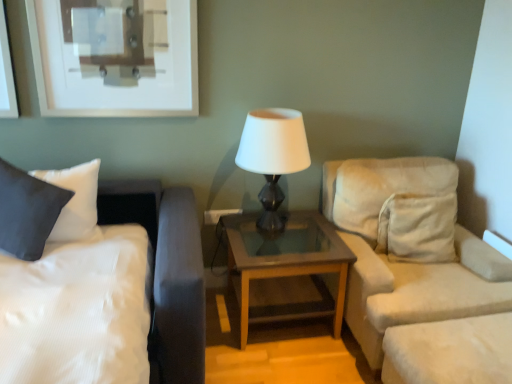
Question: Is satin white bed at left far away from beige fabric studio couch at right?

Choices:
 (A) yes
 (B) no

Answer: (A)

Question: From the image's perspective, is satin white bed at left over beige fabric studio couch at right?

Choices:
 (A) yes
 (B) no

Answer: (B)

Question: Is satin white bed at left beside beige fabric studio couch at right?

Choices:
 (A) yes
 (B) no

Answer: (B)

Question: Is satin white bed at left further to the viewer compared to beige fabric studio couch at right?

Choices:
 (A) no
 (B) yes

Answer: (A)

Question: Considering the relative sizes of satin white bed at left and beige fabric studio couch at right in the image provided, is satin white bed at left bigger than beige fabric studio couch at right?

Choices:
 (A) no
 (B) yes

Answer: (B)

Question: Is satin white bed at left facing towards beige fabric studio couch at right?

Choices:
 (A) no
 (B) yes

Answer: (A)

Question: Can you confirm if brown wood/glass table at center is smaller than matte black pillow at left?

Choices:
 (A) no
 (B) yes

Answer: (A)

Question: Is brown wood/glass table at center touching matte black pillow at left?

Choices:
 (A) yes
 (B) no

Answer: (B)

Question: Could matte black pillow at left be considered to be inside brown wood/glass table at center?

Choices:
 (A) yes
 (B) no

Answer: (B)

Question: Does brown wood/glass table at center lie in front of matte black pillow at left?

Choices:
 (A) yes
 (B) no

Answer: (B)

Question: Does brown wood/glass table at center turn towards matte black pillow at left?

Choices:
 (A) yes
 (B) no

Answer: (B)

Question: From a real-world perspective, is brown wood/glass table at center physically below matte black pillow at left?

Choices:
 (A) yes
 (B) no

Answer: (A)

Question: Does white glossy lamp at center lie in front of beige fabric studio couch at right?

Choices:
 (A) no
 (B) yes

Answer: (A)